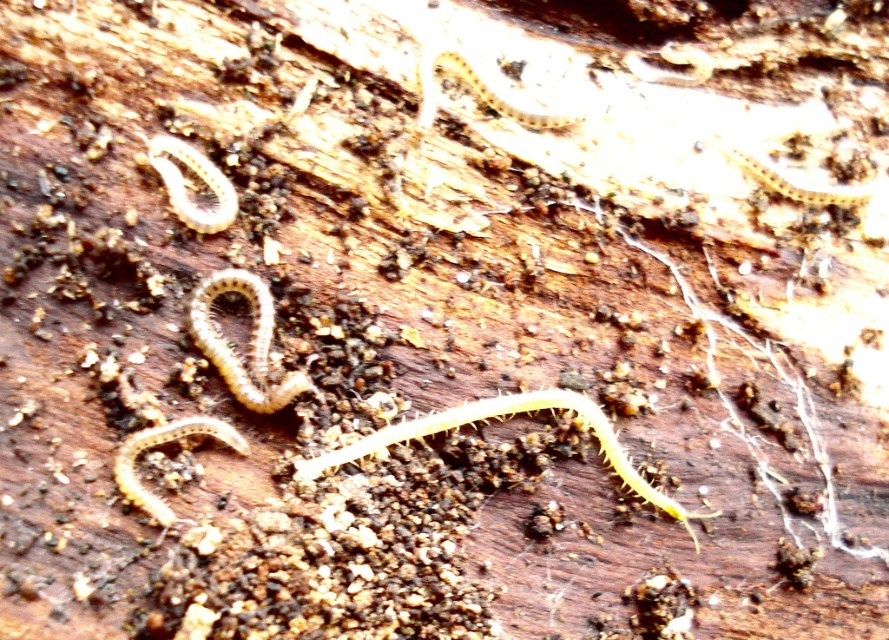
What do you see at coordinates (505, 413) in the screenshot? The width and height of the screenshot is (889, 640). I see `yellow spiny worm at center` at bounding box center [505, 413].

The width and height of the screenshot is (889, 640). Describe the element at coordinates (505, 413) in the screenshot. I see `yellow spiny worm at center` at that location.

At what (x,y) coordinates should I click in order to perform the action: click on yellow spiny worm at center. Please return your answer as a coordinate pair (x, y). Looking at the image, I should click on (505, 413).

Which is more to the right, yellowish-brown segmented centipede at center or translucent yellow worm at upper left?

yellowish-brown segmented centipede at center

Is yellowish-brown segmented centipede at center to the right of translucent yellow worm at upper left from the viewer's perspective?

Indeed, yellowish-brown segmented centipede at center is positioned on the right side of translucent yellow worm at upper left.

Where is `yellowish-brown segmented centipede at center`? yellowish-brown segmented centipede at center is located at coordinates (247, 342).

At what (x,y) coordinates should I click in order to perform the action: click on translucent yellow worm at upper left. Please return your answer as a coordinate pair (x, y). This screenshot has width=889, height=640. Looking at the image, I should click on (183, 188).

Is translucent yellow worm at upper left behind yellow spiny worm at upper right?

No.

At what (x,y) coordinates should I click in order to perform the action: click on translucent yellow worm at upper left. Please return your answer as a coordinate pair (x, y). Image resolution: width=889 pixels, height=640 pixels. Looking at the image, I should click on (183, 188).